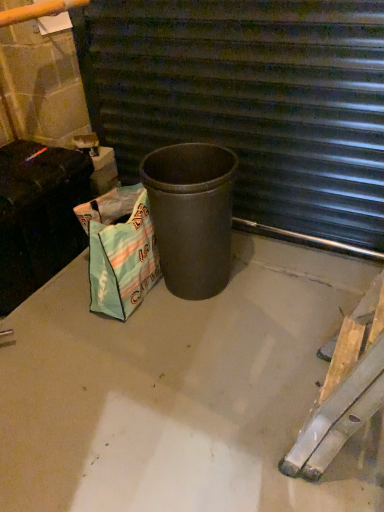
Question: From a real-world perspective, is matte black trash can at center on textured green shopping bag at lower left?

Choices:
 (A) yes
 (B) no

Answer: (A)

Question: From the image's perspective, is matte black trash can at center above textured green shopping bag at lower left?

Choices:
 (A) yes
 (B) no

Answer: (A)

Question: Does matte black trash can at center have a larger size compared to textured green shopping bag at lower left?

Choices:
 (A) no
 (B) yes

Answer: (B)

Question: Does matte black trash can at center have a greater height compared to textured green shopping bag at lower left?

Choices:
 (A) yes
 (B) no

Answer: (A)

Question: Is matte black trash can at center with textured green shopping bag at lower left?

Choices:
 (A) yes
 (B) no

Answer: (B)

Question: Is matte black trash can at center spatially inside matte black trash can at center, or outside of it?

Choices:
 (A) inside
 (B) outside

Answer: (B)

Question: Looking at their shapes, would you say matte black trash can at center is wider or thinner than matte black trash can at center?

Choices:
 (A) wide
 (B) thin

Answer: (B)

Question: Is point (306, 45) closer or farther from the camera than point (221, 256)?

Choices:
 (A) farther
 (B) closer

Answer: (B)

Question: From a real-world perspective, relative to matte black trash can at center, is matte black trash can at center vertically above or below?

Choices:
 (A) below
 (B) above

Answer: (B)

Question: Based on their positions, is textured green shopping bag at lower left located to the left or right of matte black trash can at center?

Choices:
 (A) left
 (B) right

Answer: (A)

Question: From the image's perspective, relative to matte black trash can at center, is textured green shopping bag at lower left above or below?

Choices:
 (A) below
 (B) above

Answer: (A)

Question: From a real-world perspective, relative to matte black trash can at center, is textured green shopping bag at lower left vertically above or below?

Choices:
 (A) above
 (B) below

Answer: (B)

Question: Considering the positions of textured green shopping bag at lower left and matte black trash can at center in the image, is textured green shopping bag at lower left taller or shorter than matte black trash can at center?

Choices:
 (A) short
 (B) tall

Answer: (A)

Question: Is smooth concrete at center in front of or behind matte black trash can at center in the image?

Choices:
 (A) front
 (B) behind

Answer: (A)

Question: From their relative heights in the image, would you say smooth concrete at center is taller or shorter than matte black trash can at center?

Choices:
 (A) short
 (B) tall

Answer: (A)